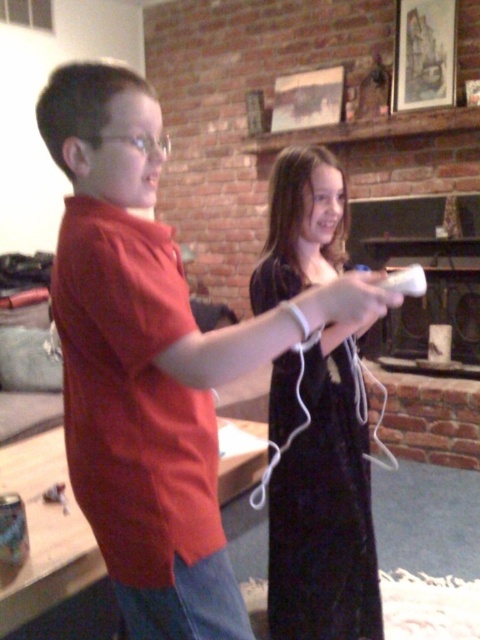
Question: Which object is positioned farthest from the white matte remote at center?

Choices:
 (A) matte red shirt at center
 (B) black velvet dress at center

Answer: (B)

Question: Does matte red shirt at center come in front of black velvet dress at center?

Choices:
 (A) no
 (B) yes

Answer: (B)

Question: Which point appears closest to the camera in this image?

Choices:
 (A) (340, 332)
 (B) (412, 285)
 (C) (156, 100)

Answer: (B)

Question: Considering the relative positions of matte red shirt at center and black velvet dress at center in the image provided, where is matte red shirt at center located with respect to black velvet dress at center?

Choices:
 (A) above
 (B) below

Answer: (A)

Question: Is the position of matte red shirt at center more distant than that of white matte remote at center?

Choices:
 (A) no
 (B) yes

Answer: (A)

Question: Based on their relative distances, which object is farther from the white matte remote at center?

Choices:
 (A) matte red shirt at center
 (B) black velvet dress at center

Answer: (B)